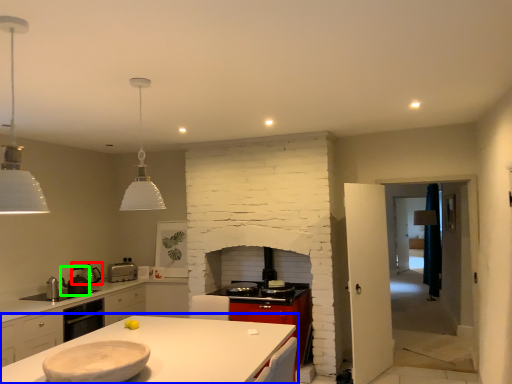
Question: Estimate the real-world distances between objects in this image. Which object is closer to appliance (highlighted by a red box), countertop (highlighted by a blue box) or appliance (highlighted by a green box)?

Choices:
 (A) countertop
 (B) appliance

Answer: (B)